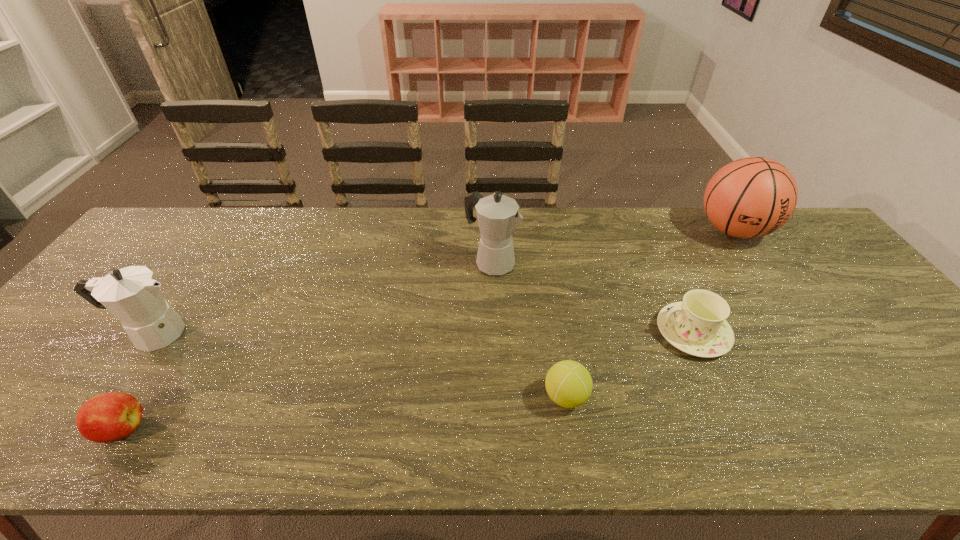
The width and height of the screenshot is (960, 540). What are the coordinates of `free area in between the tennis ball and the nearer coffeepot` in the screenshot? It's located at (359, 365).

This screenshot has height=540, width=960. Find the location of `free space between the fourth object from left to right and the apple`. free space between the fourth object from left to right and the apple is located at coordinates (344, 413).

I want to click on vacant space that's between the fourth object from left to right and the rightmost object, so click(x=650, y=314).

Where is `vacant region between the chinaware and the fourth object from right to left`? The height and width of the screenshot is (540, 960). vacant region between the chinaware and the fourth object from right to left is located at coordinates (592, 298).

Locate an element on the screen. This screenshot has height=540, width=960. empty location between the apple and the tennis ball is located at coordinates (344, 413).

Where is `vacant point located between the apple and the nearer coffeepot`? vacant point located between the apple and the nearer coffeepot is located at coordinates (137, 381).

Where is `vacant area that lies between the apple and the basketball`? vacant area that lies between the apple and the basketball is located at coordinates (428, 330).

At what (x,y) coordinates should I click in order to perform the action: click on object identified as the third closest to the third object from right to left. Please return your answer as a coordinate pair (x, y). Looking at the image, I should click on (751, 197).

Find the location of a particular element. The width and height of the screenshot is (960, 540). object that ranks as the closest to the apple is located at coordinates (132, 294).

At what (x,y) coordinates should I click in order to perform the action: click on vacant space that satisfies the following two spatial constraints: 1. at the spout of the nearer coffeepot; 2. on the left side of the apple. Please return your answer as a coordinate pair (x, y). The image size is (960, 540). Looking at the image, I should click on (84, 429).